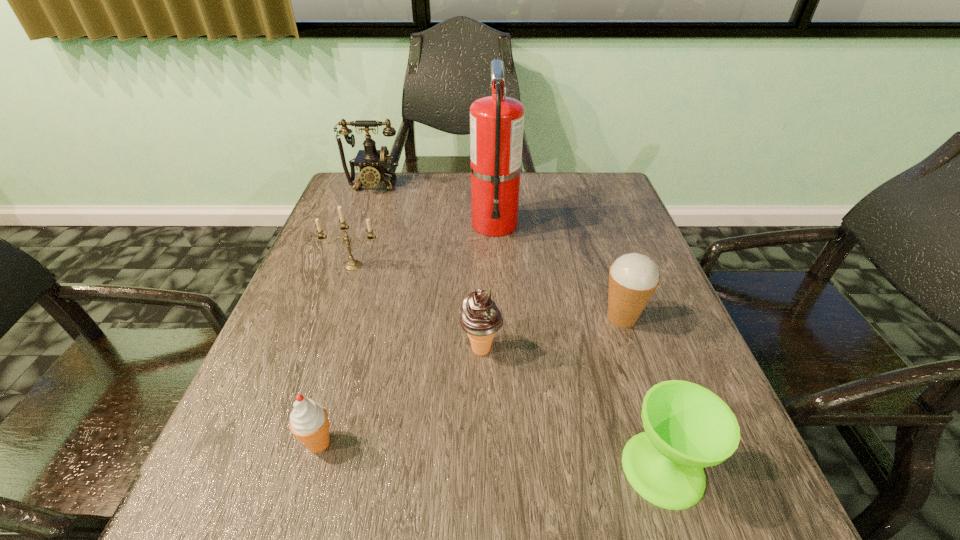
Locate an element on the screen. This screenshot has height=540, width=960. vacant space situated 0.300m at the nozzle of the fire extinguisher is located at coordinates (499, 332).

In order to click on free region located 0.390m on the rotary dial of the farthest object in this screenshot , I will do `click(338, 284)`.

The width and height of the screenshot is (960, 540). I want to click on free space located 0.110m on the right of the candle, so tap(428, 266).

The height and width of the screenshot is (540, 960). I want to click on vacant point located on the front of the second icecream from left to right, so click(x=482, y=446).

Identify the location of vacant space situated 0.070m on the front of the rightmost icecream. (636, 363).

Identify the location of free region located on the left of the wineglass. This screenshot has height=540, width=960. (513, 468).

Image resolution: width=960 pixels, height=540 pixels. I want to click on free space located on the right of the leftmost icecream, so click(x=460, y=443).

The width and height of the screenshot is (960, 540). In order to click on fire extinguisher that is positioned at the far edge in this screenshot , I will do `click(496, 122)`.

This screenshot has height=540, width=960. I want to click on telephone that is at the far edge, so click(372, 163).

Locate an element on the screen. Image resolution: width=960 pixels, height=540 pixels. object located at the near edge is located at coordinates (687, 427).